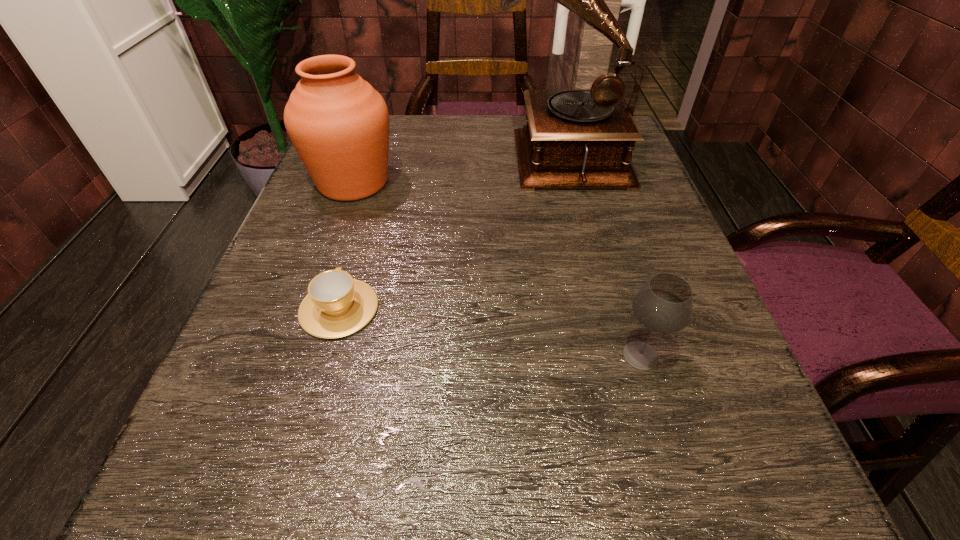
Where is `vacant space situated with the handle on the side of the cup`? The height and width of the screenshot is (540, 960). vacant space situated with the handle on the side of the cup is located at coordinates (373, 190).

The width and height of the screenshot is (960, 540). In order to click on vacant area situated 0.340m with the handle on the side of the cup in this screenshot , I will do `click(380, 165)`.

Locate an element on the screen. This screenshot has height=540, width=960. record player located in the far edge section of the desktop is located at coordinates (574, 138).

Locate an element on the screen. This screenshot has width=960, height=540. urn present at the far edge is located at coordinates (338, 123).

Find the location of `urn located at the left edge`. urn located at the left edge is located at coordinates (338, 123).

I want to click on cup situated at the left edge, so click(x=336, y=305).

Where is `record player located in the right edge section of the desktop`? The width and height of the screenshot is (960, 540). record player located in the right edge section of the desktop is located at coordinates coord(574,138).

You are a GUI agent. You are given a task and a screenshot of the screen. Output one action in this format:
    pyautogui.click(x=<x>, y=<y>)
    Task: Click on the wineglass that is positioned at the right edge
    This screenshot has width=960, height=540.
    Given the screenshot: What is the action you would take?
    pyautogui.click(x=664, y=304)

Identify the location of object present at the far left corner. The height and width of the screenshot is (540, 960). (338, 123).

Locate an element on the screen. object positioned at the far right corner is located at coordinates (574, 138).